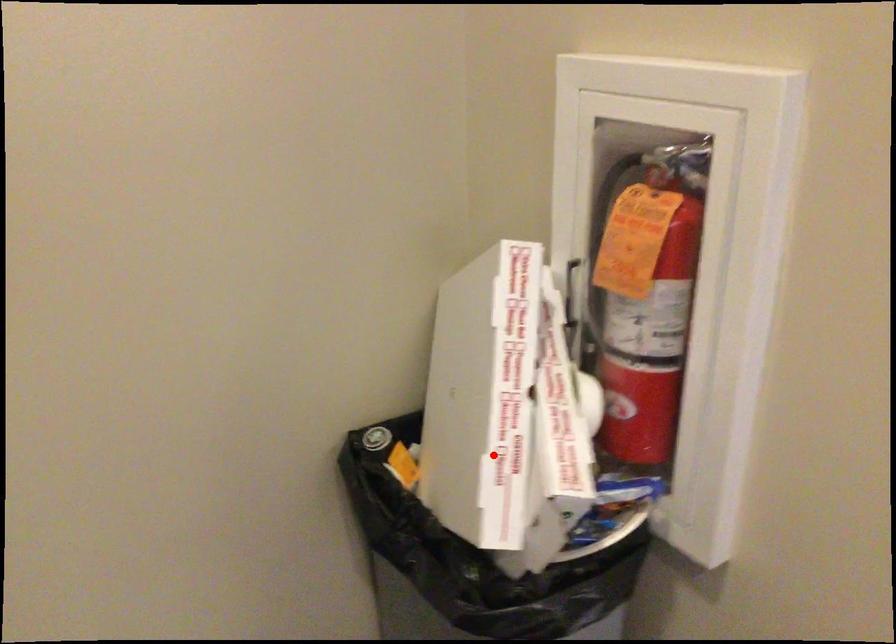
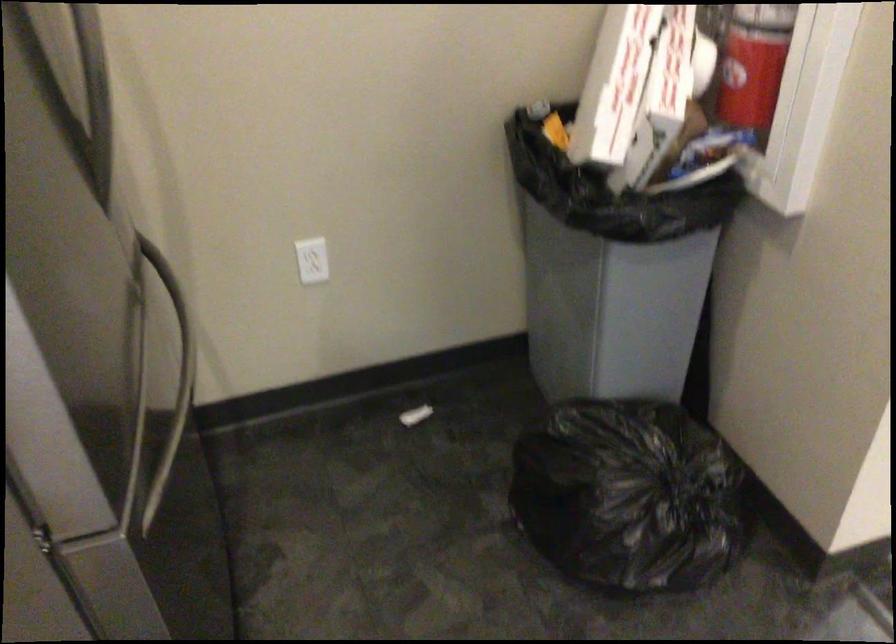
Where in the second image is the point corresponding to the highlighted location from the first image?

(614, 84)